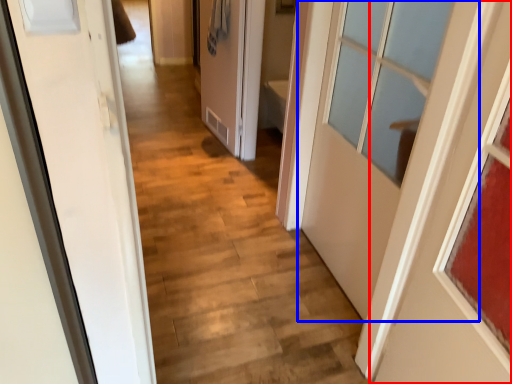
Question: Which of the following is the farthest to the observer, door (highlighted by a red box) or door (highlighted by a blue box)?

Choices:
 (A) door
 (B) door

Answer: (B)